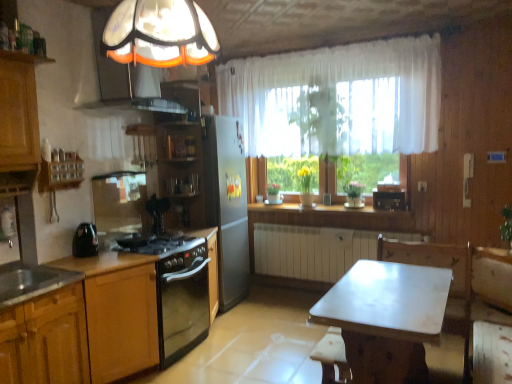
Question: Is white marble table at center turned away from matte glass exhaust hood at upper left?

Choices:
 (A) no
 (B) yes

Answer: (A)

Question: Is white marble table at center not close to matte glass exhaust hood at upper left?

Choices:
 (A) yes
 (B) no

Answer: (A)

Question: Is white marble table at center wider than matte glass exhaust hood at upper left?

Choices:
 (A) no
 (B) yes

Answer: (B)

Question: Is white marble table at center smaller than matte glass exhaust hood at upper left?

Choices:
 (A) no
 (B) yes

Answer: (A)

Question: From the image's perspective, is white marble table at center below matte glass exhaust hood at upper left?

Choices:
 (A) no
 (B) yes

Answer: (B)

Question: Is stainless steel sink at lower left situated inside black matte stove at left, which is the 2th appliance from back to front, or outside?

Choices:
 (A) inside
 (B) outside

Answer: (B)

Question: Considering the positions of stainless steel sink at lower left and black matte stove at left, which is the 2th appliance from back to front, in the image, is stainless steel sink at lower left taller or shorter than black matte stove at left, which is the 2th appliance from back to front,?

Choices:
 (A) tall
 (B) short

Answer: (B)

Question: Considering the relative positions of stainless steel sink at lower left and black matte stove at left, the 1th appliance positioned from the front, in the image provided, is stainless steel sink at lower left to the left or to the right of black matte stove at left, the 1th appliance positioned from the front,?

Choices:
 (A) left
 (B) right

Answer: (A)

Question: Is stainless steel sink at lower left wider or thinner than black matte stove at left, the 1th appliance positioned from the front?

Choices:
 (A) wide
 (B) thin

Answer: (A)

Question: Considering their positions, is black plastic radio at center, which ranks as the second appliance in front-to-back order, located in front of or behind black glossy kettle at left?

Choices:
 (A) front
 (B) behind

Answer: (B)

Question: Is black plastic radio at center, which appears as the first appliance when viewed from the right, bigger or smaller than black glossy kettle at left?

Choices:
 (A) big
 (B) small

Answer: (A)

Question: In terms of width, does black plastic radio at center, the second appliance viewed from the left, look wider or thinner when compared to black glossy kettle at left?

Choices:
 (A) thin
 (B) wide

Answer: (A)

Question: Is black plastic radio at center, the second appliance viewed from the left, taller or shorter than black glossy kettle at left?

Choices:
 (A) tall
 (B) short

Answer: (B)

Question: Based on their positions, is matte glass exhaust hood at upper left located to the left or right of black glossy kettle at left?

Choices:
 (A) left
 (B) right

Answer: (B)

Question: Considering their positions, is matte glass exhaust hood at upper left located in front of or behind black glossy kettle at left?

Choices:
 (A) behind
 (B) front

Answer: (B)